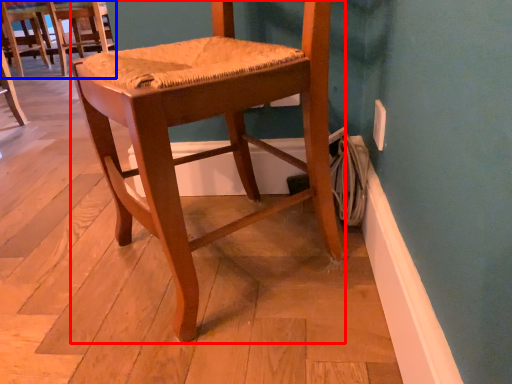
Question: Which point is closer to the camera, chair (highlighted by a red box) or chair (highlighted by a blue box)?

Choices:
 (A) chair
 (B) chair

Answer: (A)